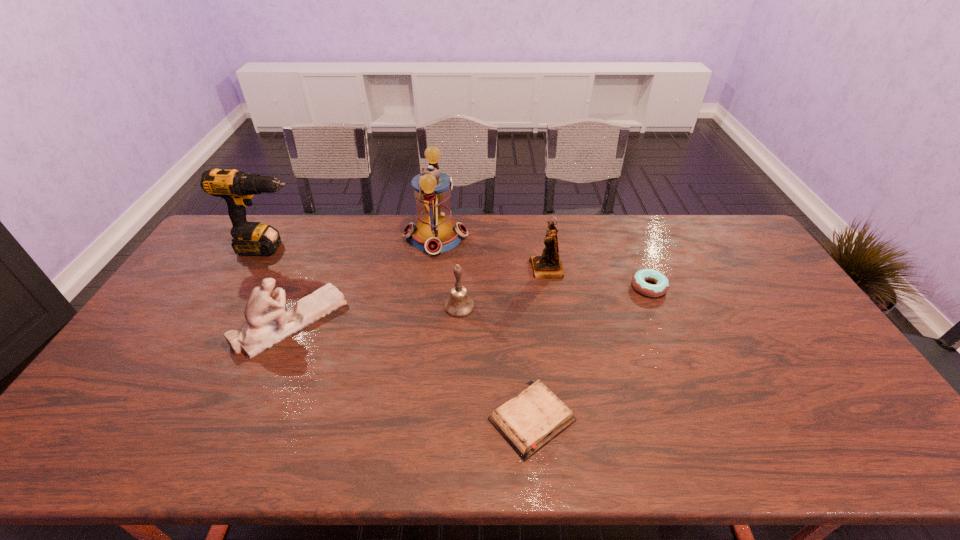
At what (x,y) coordinates should I click in order to perform the action: click on vacant space located 0.340m on the front-facing side of the lantern. Please return your answer as a coordinate pair (x, y). This screenshot has width=960, height=540. Looking at the image, I should click on (562, 237).

I want to click on free space located 0.180m at the tip of the drill, so click(x=358, y=248).

This screenshot has width=960, height=540. I want to click on free space located on the front-facing side of the farther figurine, so 503,269.

Find the location of a particular element. free space located on the front-facing side of the farther figurine is located at coordinates (446, 269).

Where is `free space located 0.050m on the front-facing side of the farther figurine`? free space located 0.050m on the front-facing side of the farther figurine is located at coordinates (516, 269).

The height and width of the screenshot is (540, 960). In order to click on free region located on the front-facing side of the nearer figurine in this screenshot , I will do `click(429, 322)`.

The width and height of the screenshot is (960, 540). Find the location of `vacant region located on the right of the bell`. vacant region located on the right of the bell is located at coordinates (572, 306).

Identify the location of free space located on the right of the doughnut. This screenshot has height=540, width=960. (748, 287).

I want to click on free region located on the left of the nearest object, so click(430, 420).

Locate an element on the screen. The width and height of the screenshot is (960, 540). lantern that is positioned at the far edge is located at coordinates (435, 232).